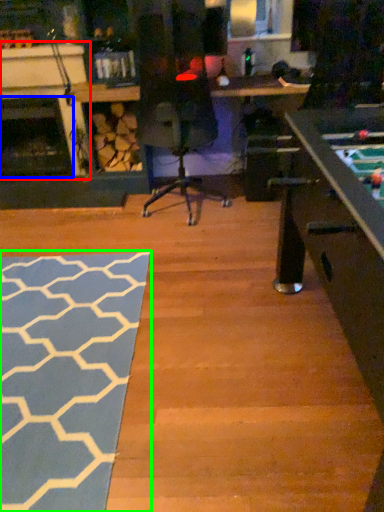
Question: Based on their relative distances, which object is farther from fireplace (highlighted by a red box)? Choose from fireplace (highlighted by a blue box) and mat (highlighted by a green box).

Choices:
 (A) fireplace
 (B) mat

Answer: (B)